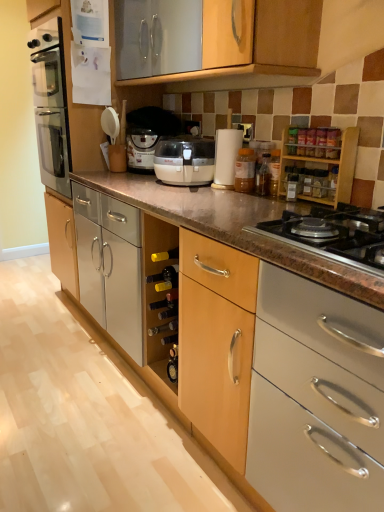
Question: Can you confirm if wooden spice rack at upper right, the second cabinetry positioned from the left, is positioned to the right of translucent plastic jar at center?

Choices:
 (A) no
 (B) yes

Answer: (B)

Question: Does wooden spice rack at upper right, the first cabinetry from the right, lie behind translucent plastic jar at center?

Choices:
 (A) no
 (B) yes

Answer: (A)

Question: From a real-world perspective, is wooden spice rack at upper right, the first cabinetry from the right, on top of translucent plastic jar at center?

Choices:
 (A) yes
 (B) no

Answer: (A)

Question: Would you say wooden spice rack at upper right, positioned as the 1th cabinetry in back-to-front order, is outside translucent plastic jar at center?

Choices:
 (A) no
 (B) yes

Answer: (B)

Question: Is wooden spice rack at upper right, positioned as the 1th cabinetry in back-to-front order, to the left of translucent plastic jar at center from the viewer's perspective?

Choices:
 (A) yes
 (B) no

Answer: (B)

Question: Is wooden spice rack at upper right, which ranks as the 2th cabinetry in bottom-to-top order, positioned in front of translucent plastic jar at center?

Choices:
 (A) no
 (B) yes

Answer: (B)

Question: Considering the relative sizes of black granite gas stove at lower right and wooden spice rack at upper right, the first cabinetry in the top-to-bottom sequence, in the image provided, is black granite gas stove at lower right shorter than wooden spice rack at upper right, the first cabinetry in the top-to-bottom sequence,?

Choices:
 (A) yes
 (B) no

Answer: (A)

Question: Can you confirm if black granite gas stove at lower right is taller than wooden spice rack at upper right, the first cabinetry in the top-to-bottom sequence?

Choices:
 (A) yes
 (B) no

Answer: (B)

Question: Is black granite gas stove at lower right further to the viewer compared to wooden spice rack at upper right, the first cabinetry from the right?

Choices:
 (A) no
 (B) yes

Answer: (A)

Question: Is black granite gas stove at lower right turned away from wooden spice rack at upper right, the first cabinetry from the right?

Choices:
 (A) no
 (B) yes

Answer: (A)

Question: Is the position of black granite gas stove at lower right less distant than that of wooden spice rack at upper right, the first cabinetry from the right?

Choices:
 (A) no
 (B) yes

Answer: (B)

Question: Does black granite gas stove at lower right appear on the left side of wooden spice rack at upper right, the second cabinetry positioned from the left?

Choices:
 (A) yes
 (B) no

Answer: (B)

Question: Is wooden spice rack at upper right, the first cabinetry from the right, taller than matte white coffee machine at center?

Choices:
 (A) no
 (B) yes

Answer: (A)